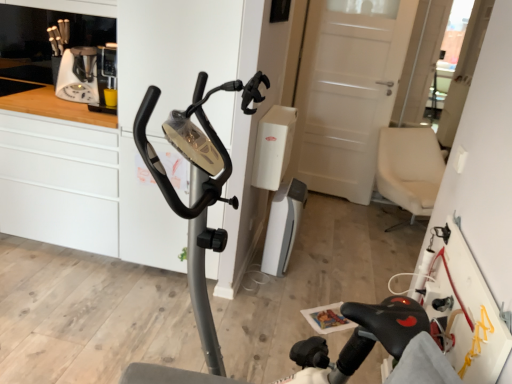
You are a GUI agent. You are given a task and a screenshot of the screen. Output one action in this format:
    pyautogui.click(x=<x>, y=<y>)
    Task: Click on the vacant region to the right of white plastic vacuum cleaner at center
    
    Given the screenshot: What is the action you would take?
    click(x=323, y=263)